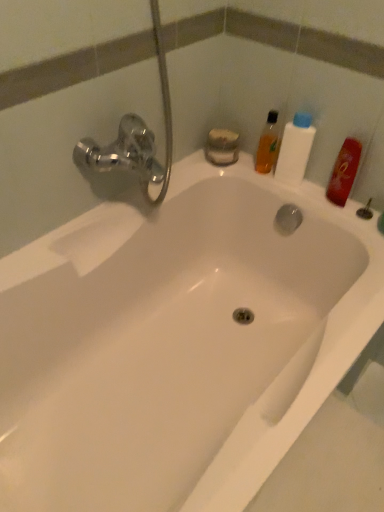
Question: Is there a large distance between red matte bottle at upper right, which appears as the 1th mouthwash when viewed from the right, and translucent orange bottle at upper right, placed as the first mouthwash when sorted from left to right?

Choices:
 (A) yes
 (B) no

Answer: (B)

Question: From a real-world perspective, is red matte bottle at upper right, arranged as the second mouthwash when viewed from the left, on translucent orange bottle at upper right, placed as the first mouthwash when sorted from left to right?

Choices:
 (A) yes
 (B) no

Answer: (B)

Question: Considering the relative positions of red matte bottle at upper right, which appears as the 1th mouthwash when viewed from the right, and translucent orange bottle at upper right, placed as the first mouthwash when sorted from left to right, in the image provided, is red matte bottle at upper right, which appears as the 1th mouthwash when viewed from the right, behind translucent orange bottle at upper right, placed as the first mouthwash when sorted from left to right,?

Choices:
 (A) yes
 (B) no

Answer: (B)

Question: Is red matte bottle at upper right, arranged as the second mouthwash when viewed from the left, located outside translucent orange bottle at upper right, which is counted as the 2th mouthwash, starting from the right?

Choices:
 (A) no
 (B) yes

Answer: (B)

Question: From the image's perspective, is red matte bottle at upper right, which appears as the 1th mouthwash when viewed from the right, located above translucent orange bottle at upper right, placed as the first mouthwash when sorted from left to right?

Choices:
 (A) yes
 (B) no

Answer: (B)

Question: In the image, is red matte bottle at upper right, which appears as the 1th mouthwash when viewed from the right, on the left side or the right side of translucent orange bottle at upper right, placed as the first mouthwash when sorted from left to right?

Choices:
 (A) right
 (B) left

Answer: (A)

Question: Is red matte bottle at upper right, arranged as the second mouthwash when viewed from the left, inside or outside of translucent orange bottle at upper right, placed as the first mouthwash when sorted from left to right?

Choices:
 (A) inside
 (B) outside

Answer: (B)

Question: From a real-world perspective, relative to translucent orange bottle at upper right, which is counted as the 2th mouthwash, starting from the right, is red matte bottle at upper right, which appears as the 1th mouthwash when viewed from the right, vertically above or below?

Choices:
 (A) above
 (B) below

Answer: (B)

Question: Looking at their shapes, would you say red matte bottle at upper right, arranged as the second mouthwash when viewed from the left, is wider or thinner than translucent orange bottle at upper right, placed as the first mouthwash when sorted from left to right?

Choices:
 (A) wide
 (B) thin

Answer: (B)

Question: Is red matte bottle at upper right, arranged as the second mouthwash when viewed from the left, spatially inside white plastic bottle at upper right, or outside of it?

Choices:
 (A) outside
 (B) inside

Answer: (A)

Question: From the image's perspective, is red matte bottle at upper right, which appears as the 1th mouthwash when viewed from the right, positioned above or below white plastic bottle at upper right?

Choices:
 (A) below
 (B) above

Answer: (A)

Question: From a real-world perspective, is red matte bottle at upper right, arranged as the second mouthwash when viewed from the left, above or below white plastic bottle at upper right?

Choices:
 (A) above
 (B) below

Answer: (B)

Question: Is red matte bottle at upper right, arranged as the second mouthwash when viewed from the left, bigger or smaller than white plastic bottle at upper right?

Choices:
 (A) big
 (B) small

Answer: (B)

Question: From the image's perspective, is white plastic bottle at upper right above or below red matte bottle at upper right, which appears as the 1th mouthwash when viewed from the right?

Choices:
 (A) below
 (B) above

Answer: (B)

Question: From a real-world perspective, relative to red matte bottle at upper right, which appears as the 1th mouthwash when viewed from the right, is white plastic bottle at upper right vertically above or below?

Choices:
 (A) below
 (B) above

Answer: (B)